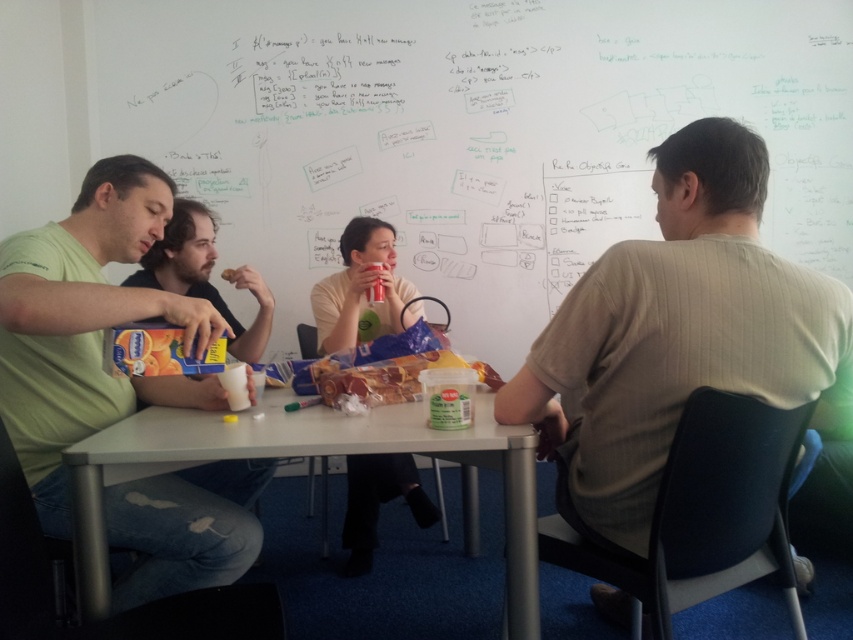
You are organizing a clothing donation drive and need to determine which shirt can fit into a standard donation box that accommodates items up to 18 inches in width. Given the light beige cotton shirt at upper right and the matte green shirt at left, which one is more likely to fit in the box based on their sizes?

The light beige cotton shirt at upper right is larger than the matte green shirt at left. Since the donation box can only accommodate items up to 18 inches wide, the matte green shirt at left is more likely to fit as it is narrower than the light beige cotton shirt at upper right.

You are standing in the classroom and want to reach the metallic silver table at center to grab a pen. Considering your height is 1.7 meters, will you have to bend down or look up to reach it?

The metallic silver table at center is 1.24 meters away from the viewer. Since the table is at center and the distance is given, but the height of the table isn